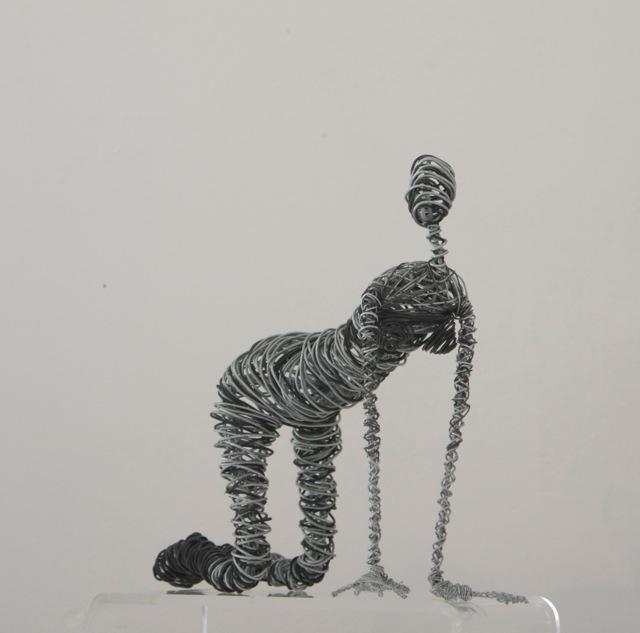
Locate an element on the screen. Image resolution: width=640 pixels, height=633 pixels. chest is located at coordinates (381, 353).